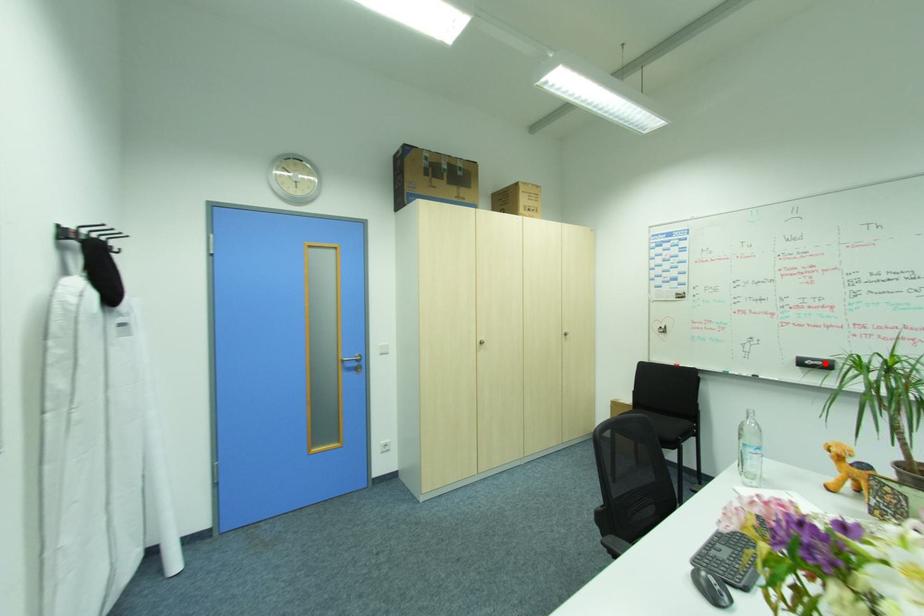
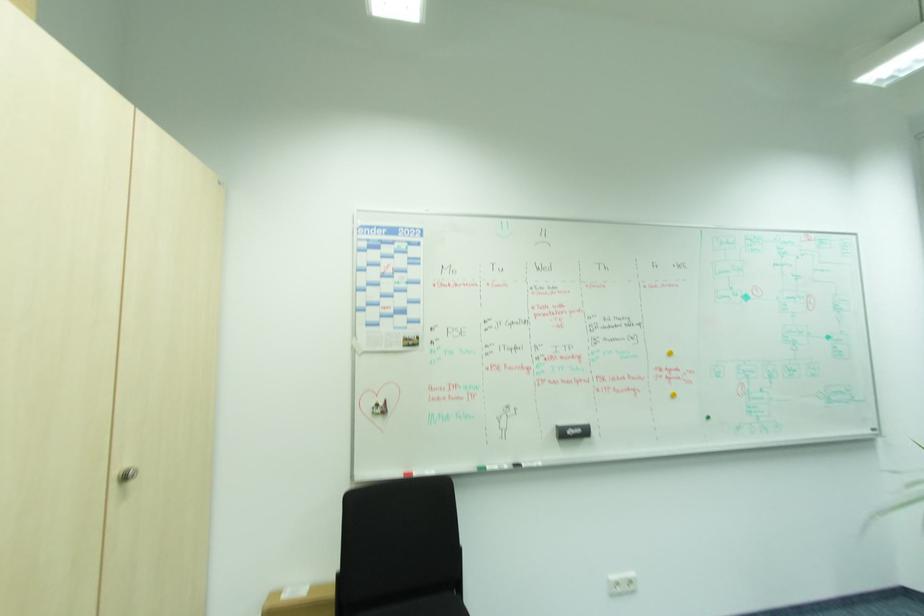
The point at the highlighted location is marked in the first image. Where is the corresponding point in the second image?

(584, 430)